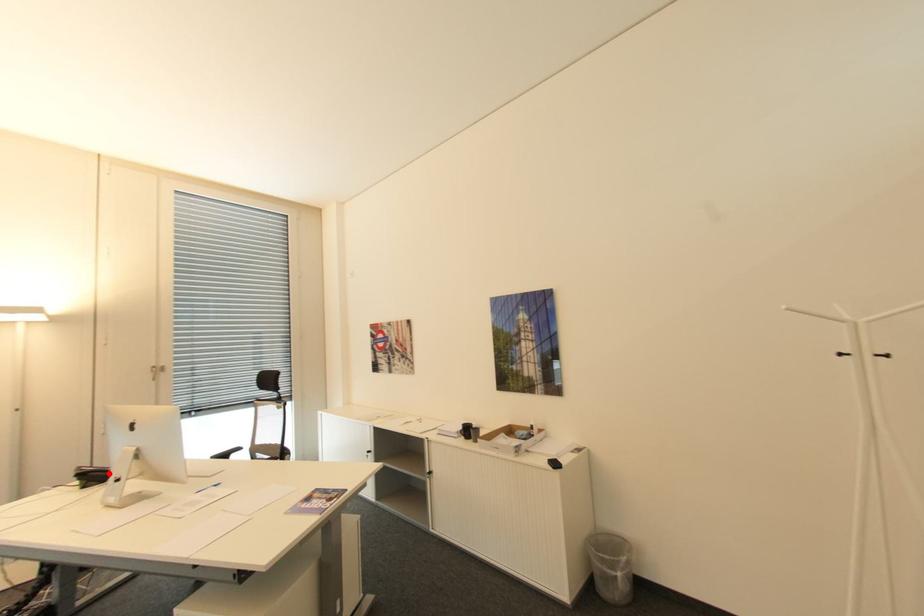
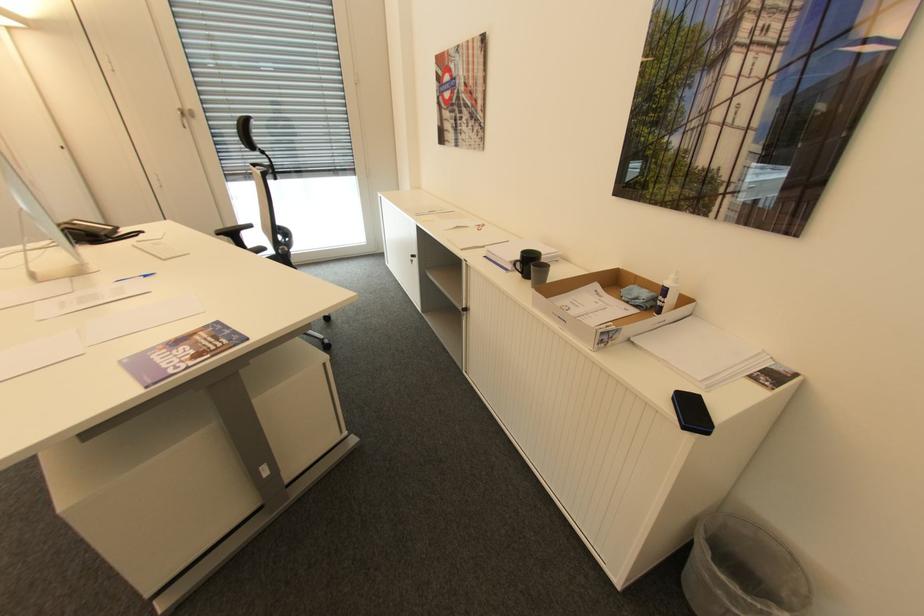
Question: I am providing you with two images of the same scene from different viewpoints. A red point is marked on the first image. Is the red point's position out of view in image 2?

Choices:
 (A) Yes
 (B) No

Answer: (B)